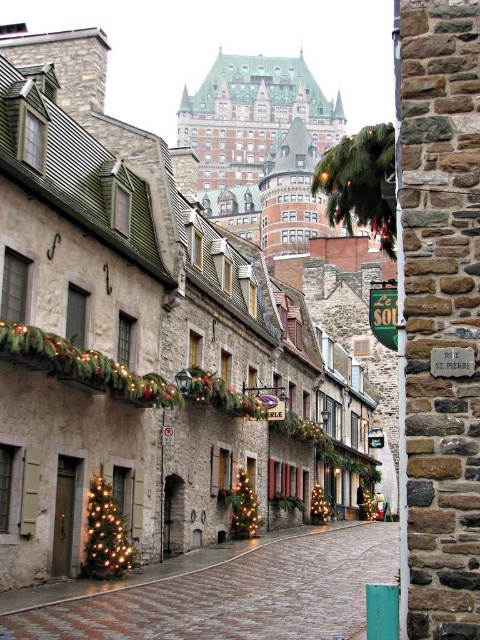
Between stone building at center and brick paved alley at center, which one is positioned lower?

brick paved alley at center is lower down.

In order to click on stone building at center in this screenshot , I will do `click(163, 330)`.

You are a GUI agent. You are given a task and a screenshot of the screen. Output one action in this format:
    pyautogui.click(x=<x>, y=<y>)
    Task: Click on the stone building at center
    The width and height of the screenshot is (480, 640).
    Given the screenshot: What is the action you would take?
    pyautogui.click(x=163, y=330)

Is stone building at center thinner than iridescent glass christmas tree at lower left?

No, stone building at center is not thinner than iridescent glass christmas tree at lower left.

Who is shorter, stone building at center or iridescent glass christmas tree at lower left?

iridescent glass christmas tree at lower left

Does point (12, 394) come behind point (113, 572)?

No, it is not.

Locate an element on the screen. The height and width of the screenshot is (640, 480). stone building at center is located at coordinates (163, 330).

Does brick paved alley at center come behind iridescent glass christmas tree at lower left?

That is False.

Is brick paved alley at center below iridescent glass christmas tree at lower left?

Yes, brick paved alley at center is below iridescent glass christmas tree at lower left.

Who is more distant from viewer, (158,580) or (106,557)?

Point (158,580)

Where is `brick paved alley at center`? Image resolution: width=480 pixels, height=640 pixels. brick paved alley at center is located at coordinates (222, 592).